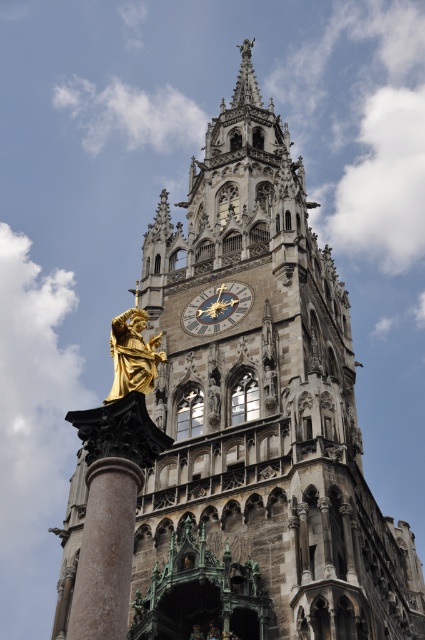
Which is more to the left, gold polished statue at center or goldmetallicclock at center?

From the viewer's perspective, gold polished statue at center appears more on the left side.

Measure the distance between gold polished statue at center and camera.

A distance of 101.88 feet exists between gold polished statue at center and camera.

Locate an element on the screen. gold polished statue at center is located at coordinates (133, 355).

Identify the location of polished marble column at center. (105, 550).

You are a GUI agent. You are given a task and a screenshot of the screen. Output one action in this format:
    pyautogui.click(x=<x>, y=<y>)
    Task: Click on the polished marble column at center
    The image size is (425, 640).
    Given the screenshot: What is the action you would take?
    click(x=105, y=550)

Is point (105, 573) more distant than point (119, 396)?

That is False.

Which is in front, point (87, 513) or point (119, 380)?

Point (87, 513) is more forward.

This screenshot has height=640, width=425. I want to click on polished marble column at center, so click(105, 550).

This screenshot has height=640, width=425. Find the location of `polished marble column at center`. polished marble column at center is located at coordinates (105, 550).